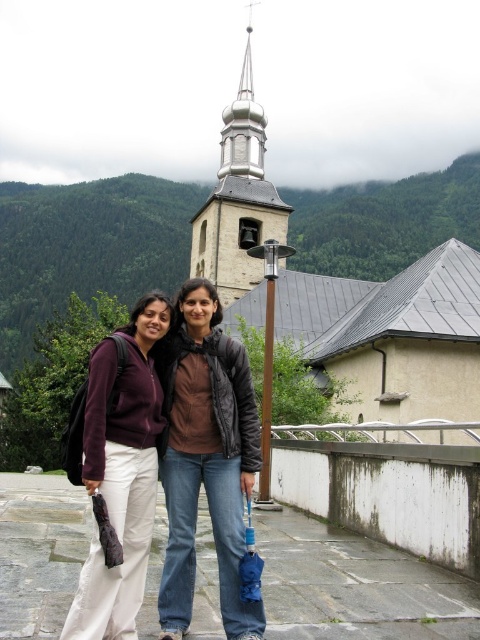
Question: Does gold polished spire at upper center have a smaller size compared to brown matte jacket at center?

Choices:
 (A) yes
 (B) no

Answer: (B)

Question: Can you confirm if matte black jacket at center is smaller than gold polished spire at upper center?

Choices:
 (A) no
 (B) yes

Answer: (B)

Question: Which object is positioned farthest from the gold polished spire at upper center?

Choices:
 (A) matte black jacket at center
 (B) brown matte jacket at center

Answer: (A)

Question: Can you confirm if matte black jacket at center is positioned to the left of brown matte jacket at center?

Choices:
 (A) no
 (B) yes

Answer: (A)

Question: Which point is closer to the camera?

Choices:
 (A) gold polished spire at upper center
 (B) matte black jacket at center
 (C) brown matte jacket at center

Answer: (B)

Question: Which of the following is the closest to the observer?

Choices:
 (A) (243, 234)
 (B) (208, 285)
 (C) (249, 458)

Answer: (C)